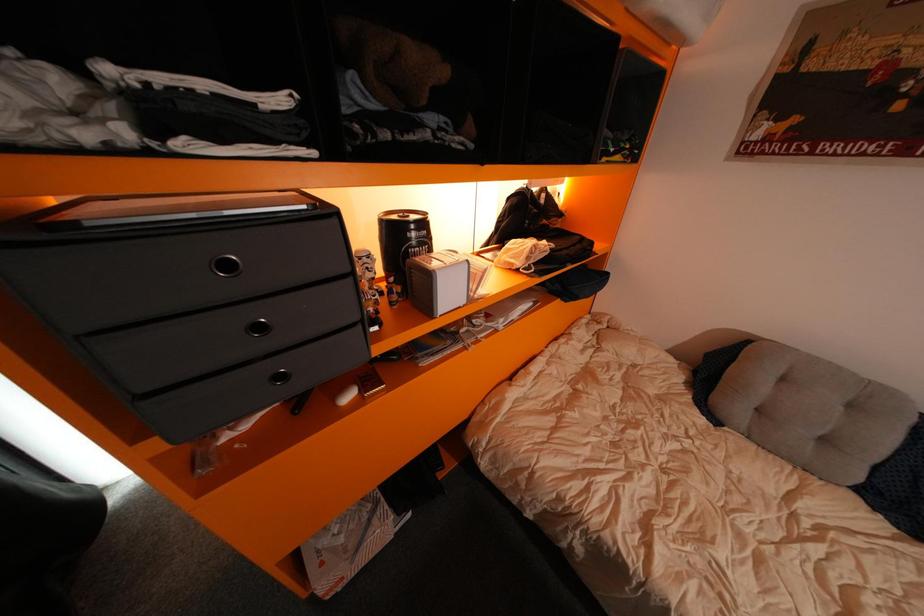
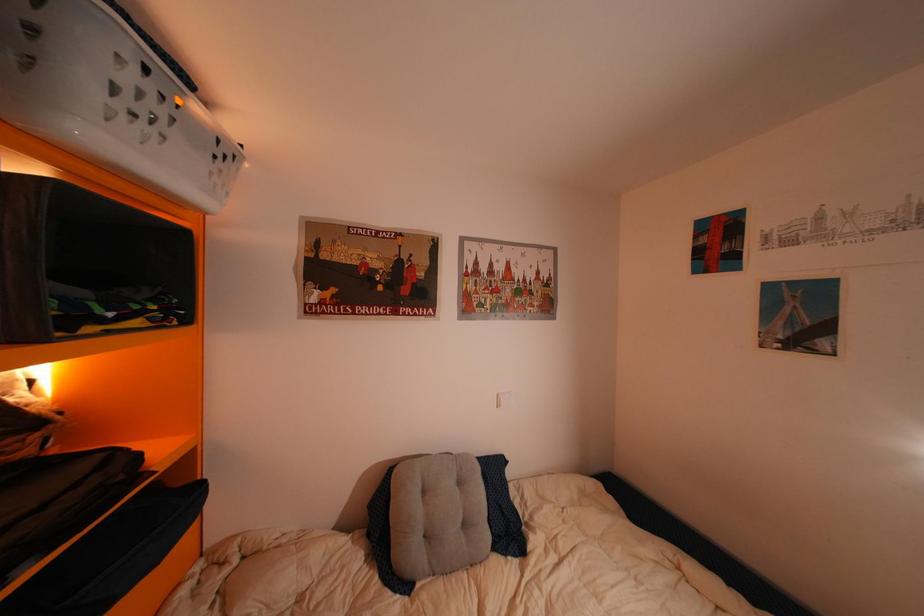
Question: How did the camera likely rotate?

Choices:
 (A) Left
 (B) Right
 (C) Up
 (D) Down

Answer: (B)